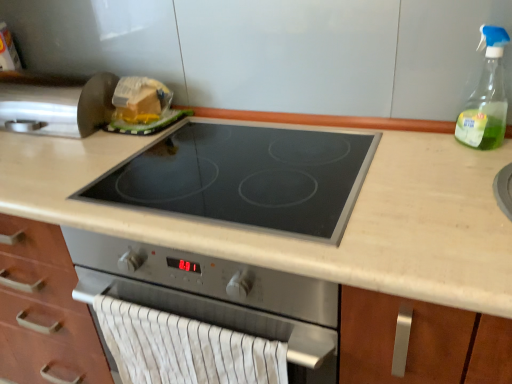
Question: Considering the relative sizes of beige laminate countertop at center and black glass cooktop at center in the image provided, is beige laminate countertop at center wider than black glass cooktop at center?

Choices:
 (A) yes
 (B) no

Answer: (A)

Question: Is beige laminate countertop at center far from black glass cooktop at center?

Choices:
 (A) no
 (B) yes

Answer: (A)

Question: Is beige laminate countertop at center outside black glass cooktop at center?

Choices:
 (A) no
 (B) yes

Answer: (B)

Question: Is beige laminate countertop at center touching black glass cooktop at center?

Choices:
 (A) yes
 (B) no

Answer: (B)

Question: From the image's perspective, would you say beige laminate countertop at center is positioned over black glass cooktop at center?

Choices:
 (A) yes
 (B) no

Answer: (B)

Question: Is beige laminate countertop at center further to the viewer compared to black glass cooktop at center?

Choices:
 (A) no
 (B) yes

Answer: (A)

Question: From a real-world perspective, does clear glass spray bottle at upper right sit lower than black glass cooktop at center?

Choices:
 (A) no
 (B) yes

Answer: (A)

Question: Can you confirm if clear glass spray bottle at upper right is thinner than black glass cooktop at center?

Choices:
 (A) no
 (B) yes

Answer: (B)

Question: From the image's perspective, is clear glass spray bottle at upper right over black glass cooktop at center?

Choices:
 (A) yes
 (B) no

Answer: (A)

Question: From the image's perspective, is clear glass spray bottle at upper right under black glass cooktop at center?

Choices:
 (A) no
 (B) yes

Answer: (A)

Question: Can you confirm if clear glass spray bottle at upper right is positioned to the right of black glass cooktop at center?

Choices:
 (A) no
 (B) yes

Answer: (B)

Question: Are clear glass spray bottle at upper right and black glass cooktop at center beside each other?

Choices:
 (A) yes
 (B) no

Answer: (B)

Question: Could you tell me if clear glass spray bottle at upper right is facing white striped fabric hand towel at lower center?

Choices:
 (A) yes
 (B) no

Answer: (A)